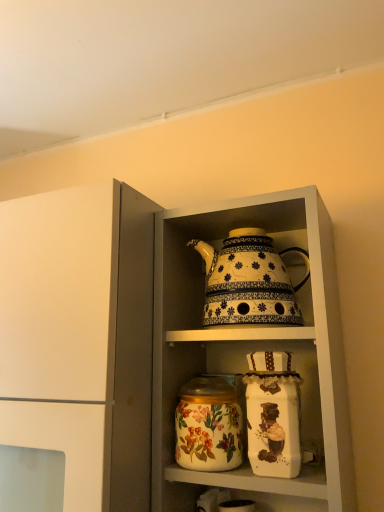
Question: Considering the relative sizes of white glossy teapot at upper center and white glossy teapot at upper center in the image provided, is white glossy teapot at upper center wider than white glossy teapot at upper center?

Choices:
 (A) no
 (B) yes

Answer: (A)

Question: Is white glossy teapot at upper center smaller than white glossy teapot at upper center?

Choices:
 (A) no
 (B) yes

Answer: (B)

Question: Is white glossy teapot at upper center thinner than white glossy teapot at upper center?

Choices:
 (A) yes
 (B) no

Answer: (A)

Question: Can we say white glossy teapot at upper center lies outside white glossy teapot at upper center?

Choices:
 (A) no
 (B) yes

Answer: (B)

Question: Is white glossy teapot at upper center to the left of white glossy teapot at upper center from the viewer's perspective?

Choices:
 (A) no
 (B) yes

Answer: (A)

Question: Can you confirm if white glossy teapot at upper center is shorter than white glossy teapot at upper center?

Choices:
 (A) no
 (B) yes

Answer: (B)

Question: From the image's perspective, is white glossy teapot at upper center below white glossy teapot at upper center?

Choices:
 (A) yes
 (B) no

Answer: (A)

Question: Can you confirm if white glossy teapot at upper center is positioned to the left of white glossy teapot at upper center?

Choices:
 (A) no
 (B) yes

Answer: (B)

Question: Are white glossy teapot at upper center and white glossy teapot at upper center located far from each other?

Choices:
 (A) no
 (B) yes

Answer: (A)

Question: Is white glossy teapot at upper center further to camera compared to white glossy teapot at upper center?

Choices:
 (A) no
 (B) yes

Answer: (A)

Question: Considering the relative positions of white glossy teapot at upper center and white glossy teapot at upper center in the image provided, is white glossy teapot at upper center to the right of white glossy teapot at upper center from the viewer's perspective?

Choices:
 (A) no
 (B) yes

Answer: (A)

Question: Does white glossy teapot at upper center turn towards white glossy teapot at upper center?

Choices:
 (A) yes
 (B) no

Answer: (B)

Question: Is white glossy teapot at upper center placed right next to decorative ceramic teapot at center?

Choices:
 (A) no
 (B) yes

Answer: (A)